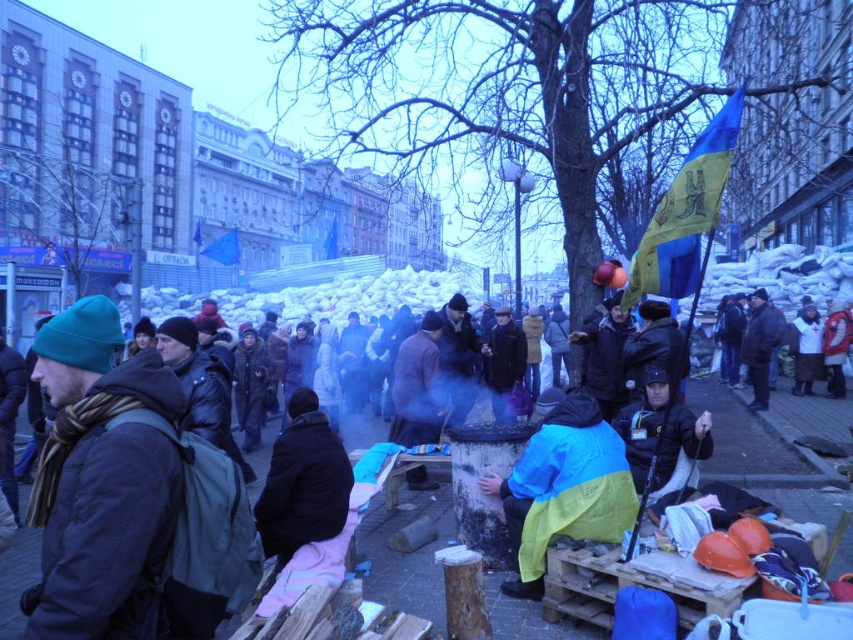
You are a photographer trying to capture a photo of the dark blue jacket at center and the black woolen jacket at center. Which jacket is positioned lower in the image?

The dark blue jacket at center is located below the black woolen jacket at center, so it is positioned lower in the image.